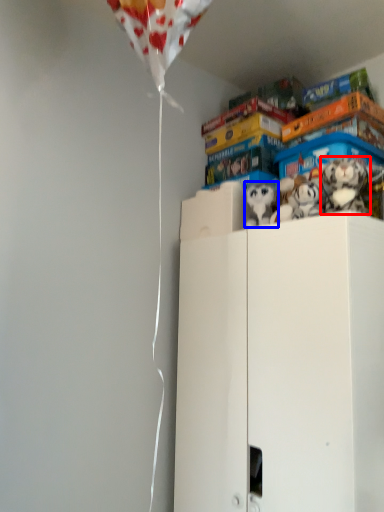
Question: Which of the following is the farthest to the observer, toy (highlighted by a red box) or toy (highlighted by a blue box)?

Choices:
 (A) toy
 (B) toy

Answer: (B)